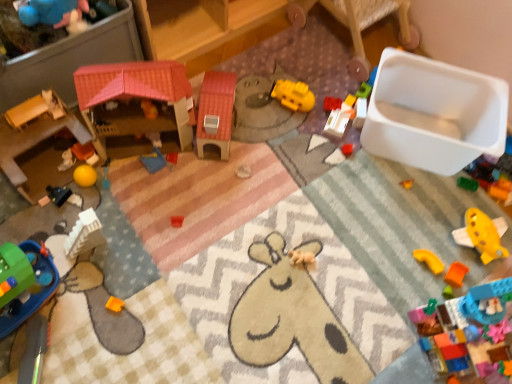
Where is `vacant space that's between yellow plastic airplane at lower right, arranged as the 15th toy when viewed from the left, and blue plastic tray at center, acting as the 6th toy starting from the left`? This screenshot has width=512, height=384. vacant space that's between yellow plastic airplane at lower right, arranged as the 15th toy when viewed from the left, and blue plastic tray at center, acting as the 6th toy starting from the left is located at coordinates (320, 206).